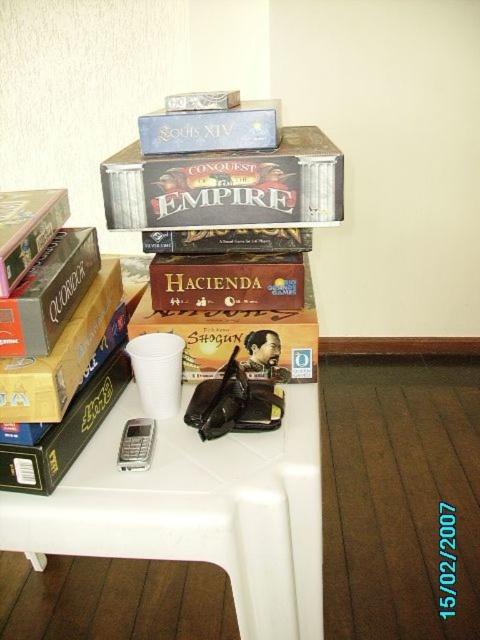
Question: Which object appears farthest from the camera in this image?

Choices:
 (A) matte brown board game at center
 (B) brown matte board game at center
 (C) matte cardboard game at center
 (D) matte cardboard game box at upper center

Answer: (B)

Question: Based on their relative distances, which object is nearer to the matte black book at lower left?

Choices:
 (A) matte cardboard game box at upper center
 (B) matte brown book at left
 (C) brown matte board game at center
 (D) white plastic table at center

Answer: (B)

Question: Is brown matte board game at center to the right of matte cardboard book at left from the viewer's perspective?

Choices:
 (A) no
 (B) yes

Answer: (B)

Question: Is the position of matte cardboard game at center less distant than that of matte brown board game at center?

Choices:
 (A) yes
 (B) no

Answer: (B)

Question: Is matte cardboard game box at upper center to the left of brown matte board game at center from the viewer's perspective?

Choices:
 (A) yes
 (B) no

Answer: (B)

Question: Which is nearer to the matte cardboard game at center?

Choices:
 (A) brown matte board game at center
 (B) blue cardboard box at upper center
 (C) matte brown board game at center

Answer: (A)